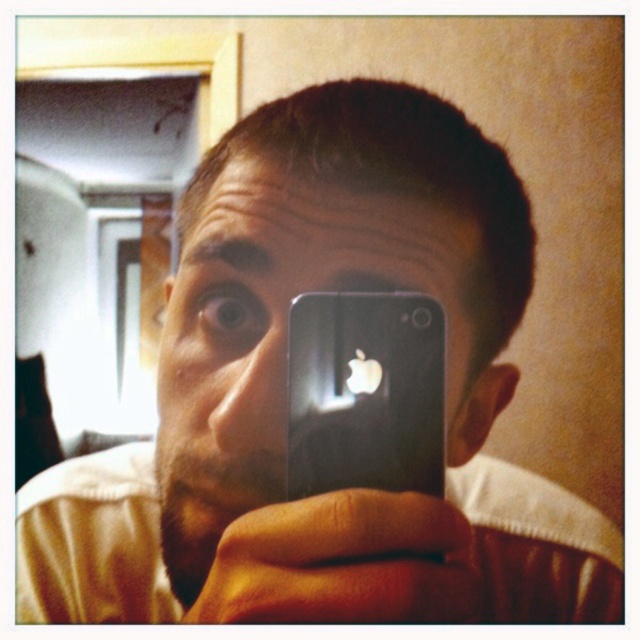
Is the position of matte black phone at center more distant than that of black matte smartphone at center?

No.

Is matte black phone at center below black matte smartphone at center?

No.

Is point (228, 317) in front of point (397, 416)?

No, (228, 317) is further to viewer.

Locate an element on the screen. This screenshot has width=640, height=640. matte black phone at center is located at coordinates (284, 356).